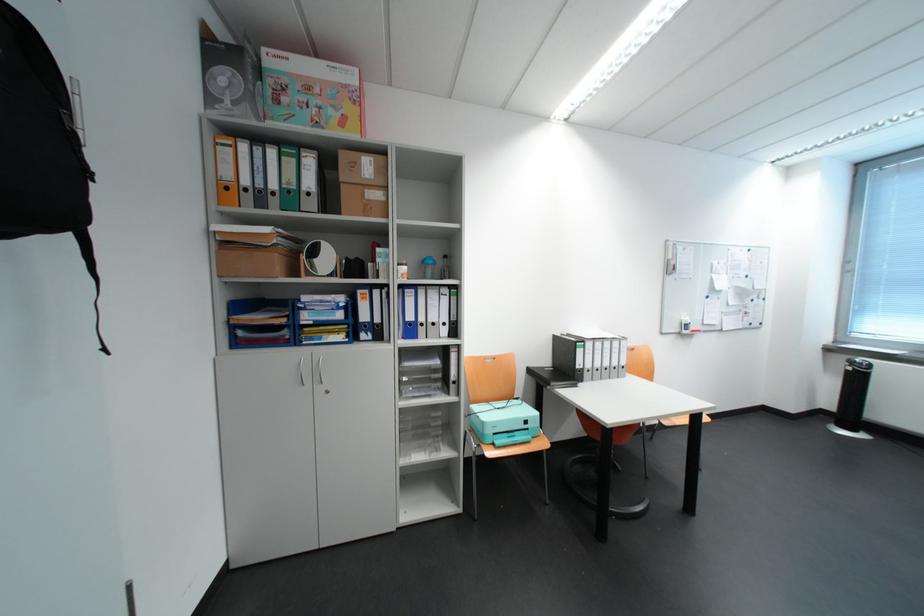
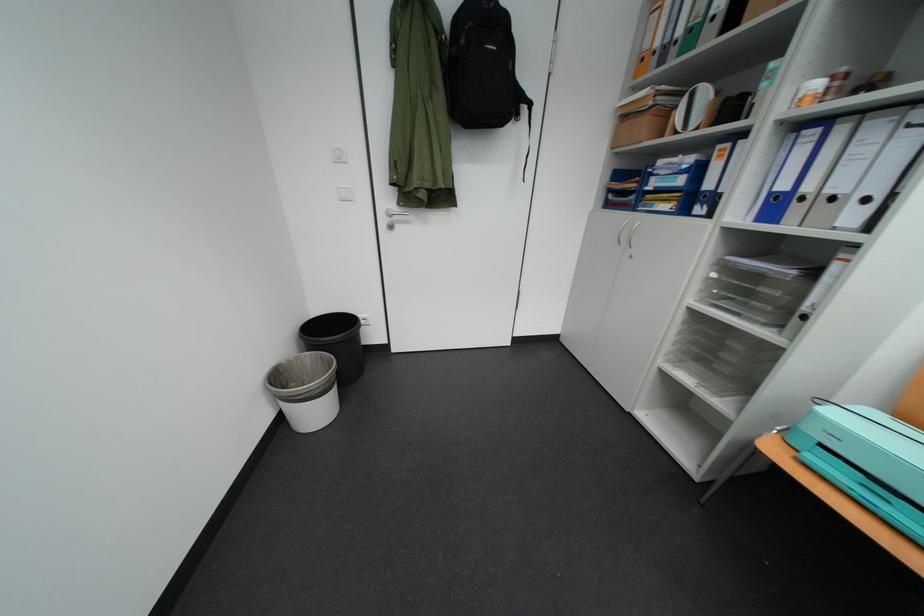
First-person continuous shooting, in which direction is the camera rotating?

The rotation direction of the camera is left-down.